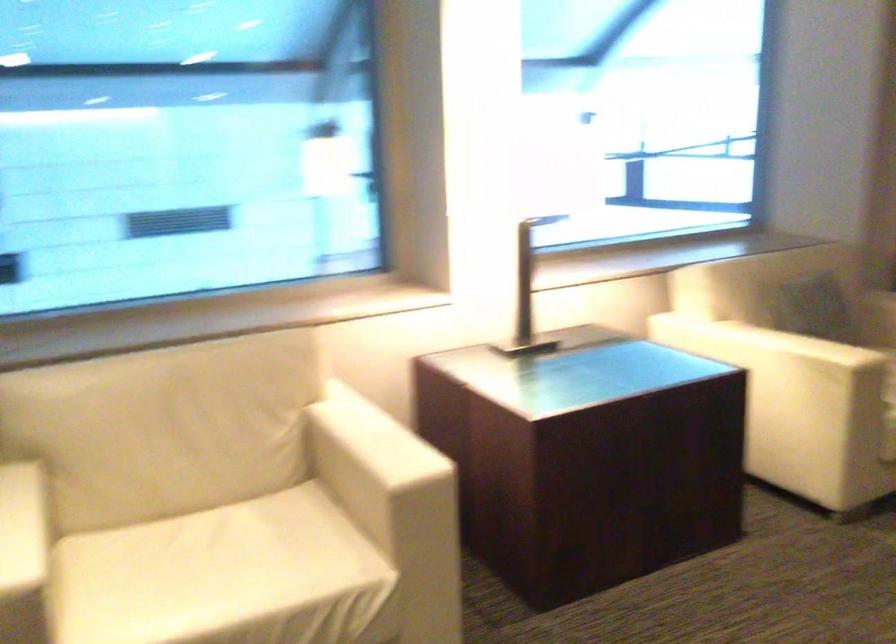
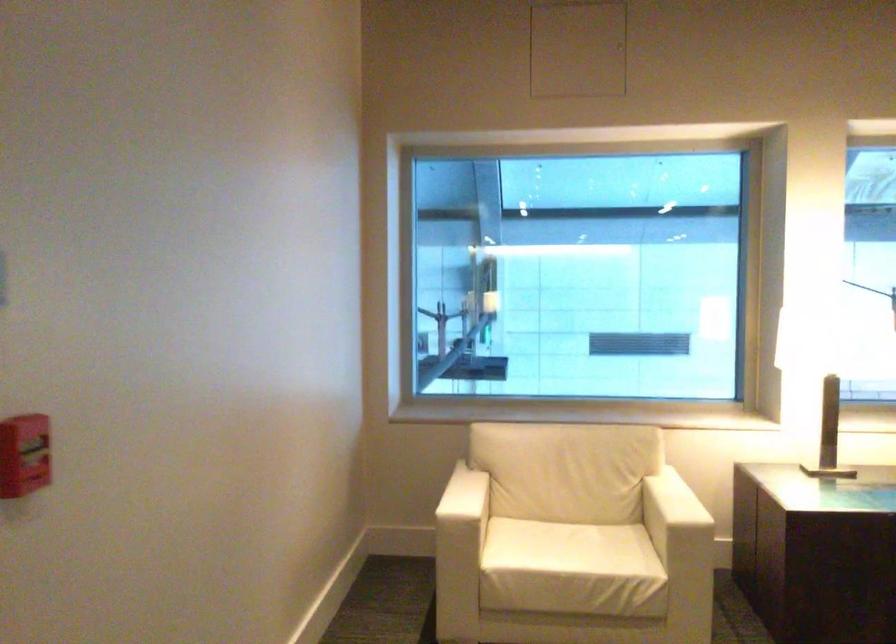
Locate, in the second image, the point that corresponds to point (375, 453) in the first image.

(673, 504)